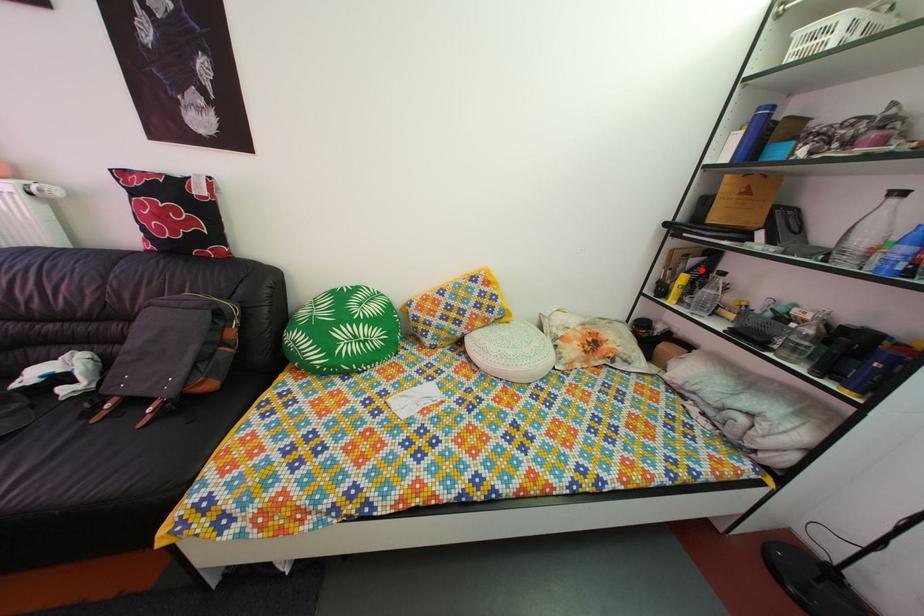
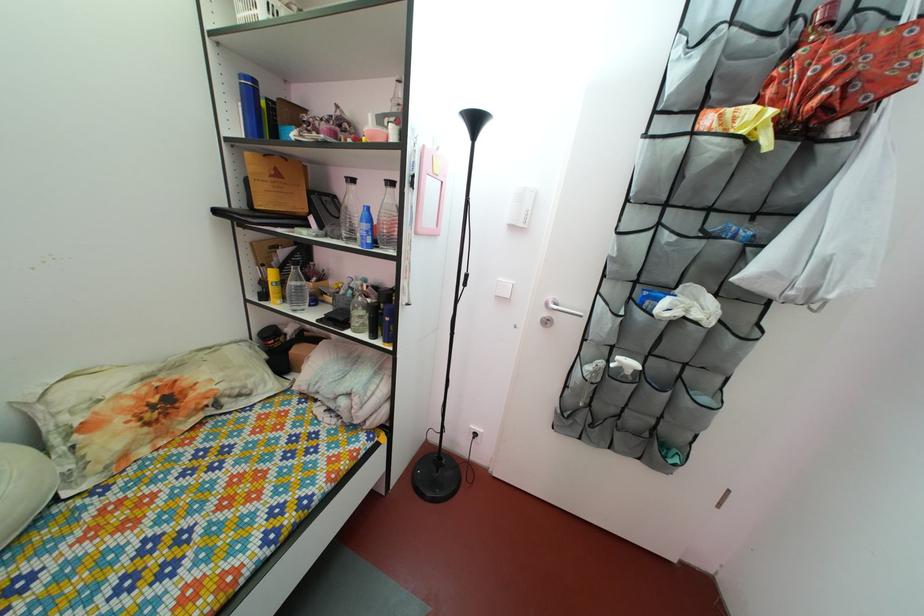
The point at the highlighted location is marked in the first image. Where is the corresponding point in the second image?

(292, 262)